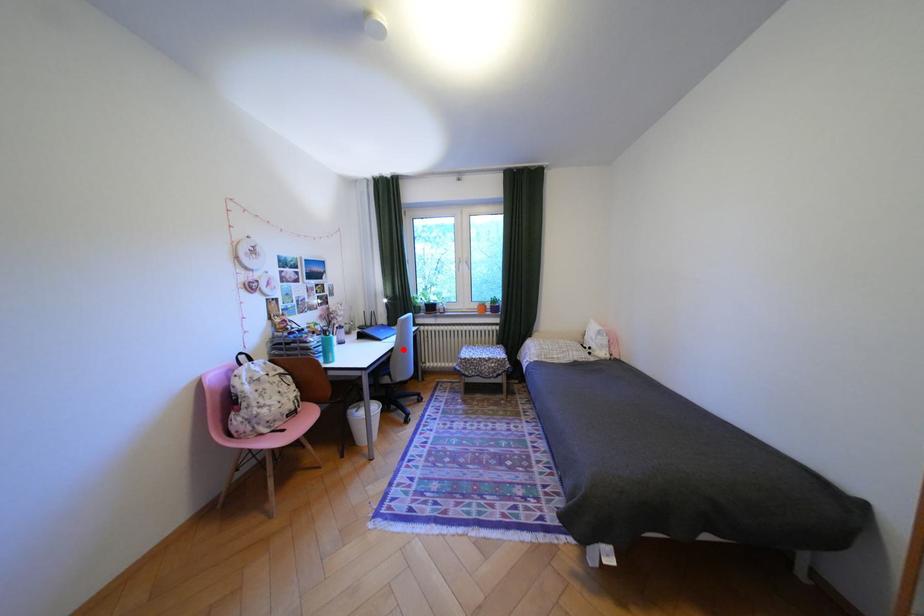
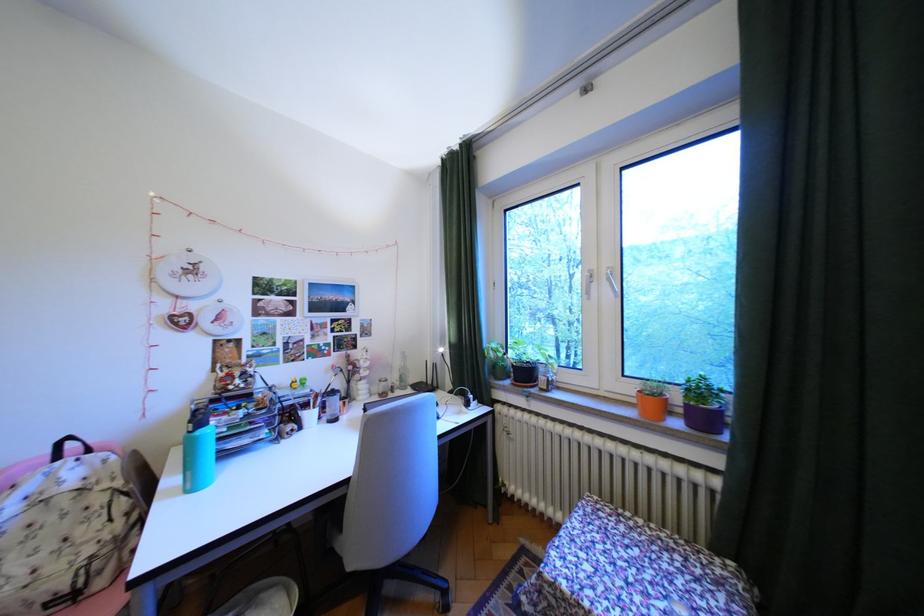
Locate, in the second image, the point that corresponds to the highlighted location in the first image.

(359, 483)